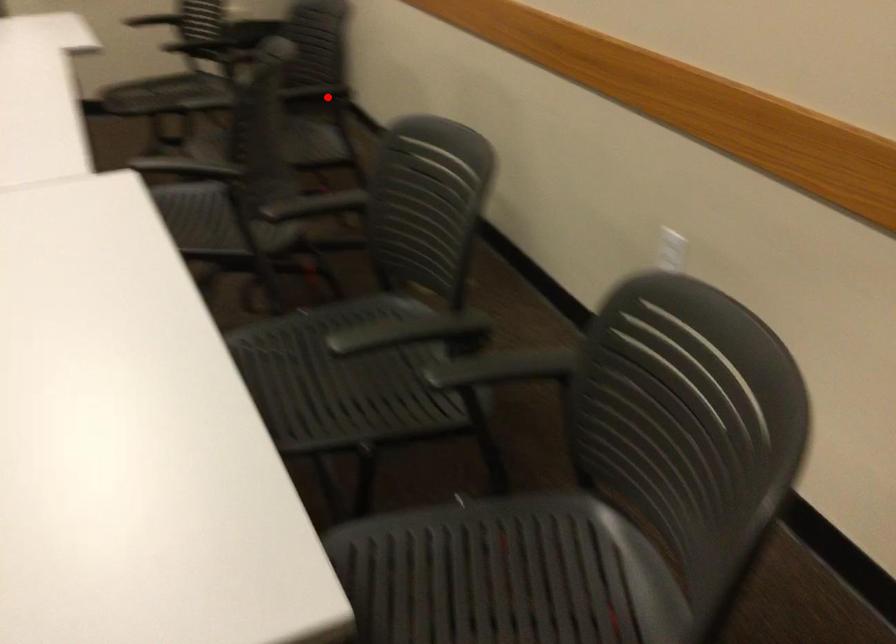
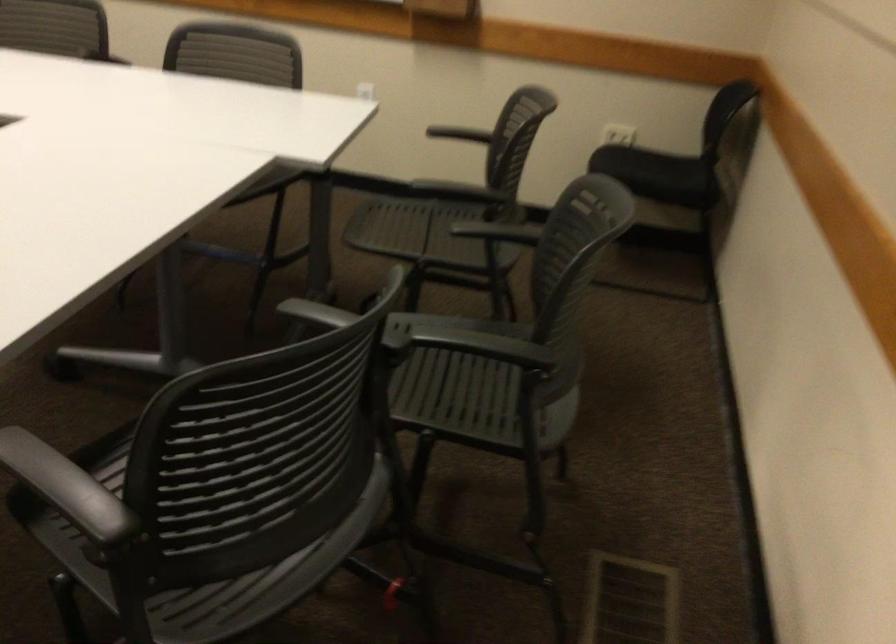
Question: A red point is marked in image1. In image2, is the corresponding 3D point closer to the camera or farther? Reply with the corresponding letter.

Choices:
 (A) The corresponding 3D point is closer.
 (B) The corresponding 3D point is farther.

Answer: (A)